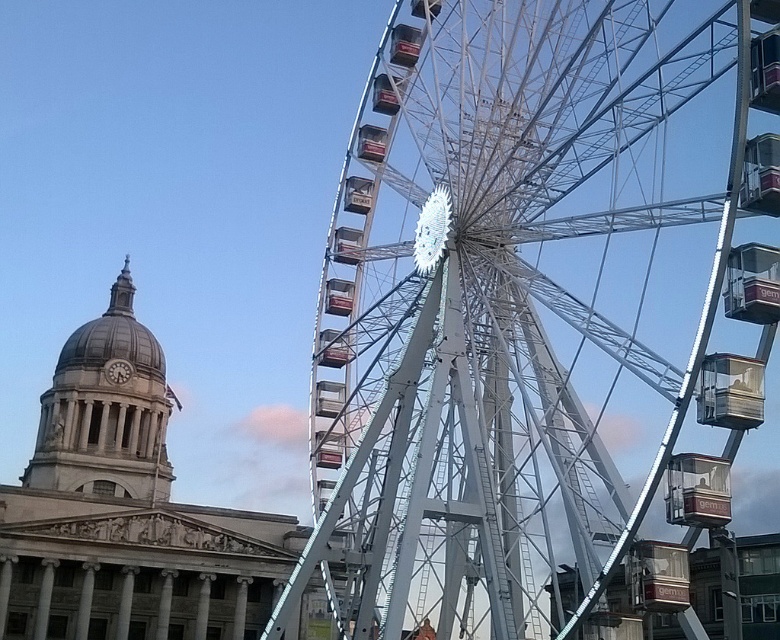
Who is lower down, white metallic ferris wheel at center or matte gray dome at upper left?

matte gray dome at upper left is below.

Between point (417, 20) and point (137, 467), which one is positioned in front?

Point (417, 20) is more forward.

Locate an element on the screen. white metallic ferris wheel at center is located at coordinates (537, 305).

I want to click on white metallic ferris wheel at center, so click(537, 305).